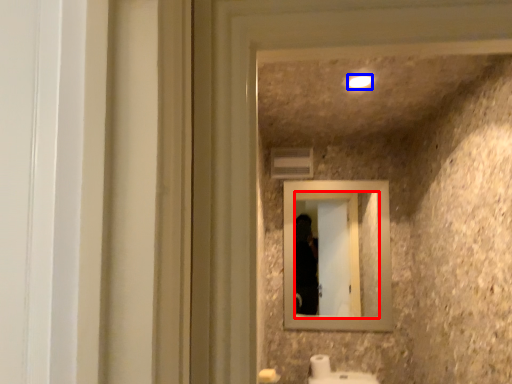
Question: Which point is further to the camera, mirror (highlighted by a red box) or light (highlighted by a blue box)?

Choices:
 (A) mirror
 (B) light

Answer: (A)